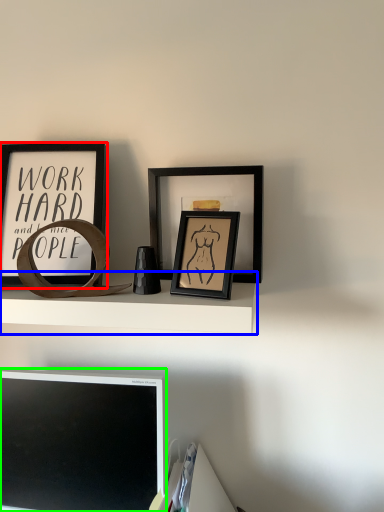
Question: Which is farther away from picture frame (highlighted by a red box)? shelf (highlighted by a blue box) or computer monitor (highlighted by a green box)?

Choices:
 (A) shelf
 (B) computer monitor

Answer: (B)